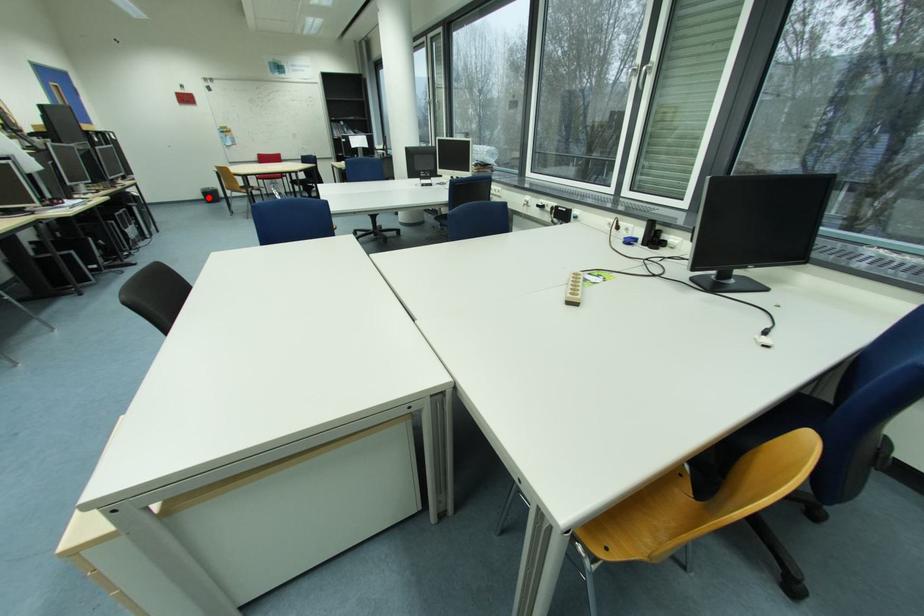
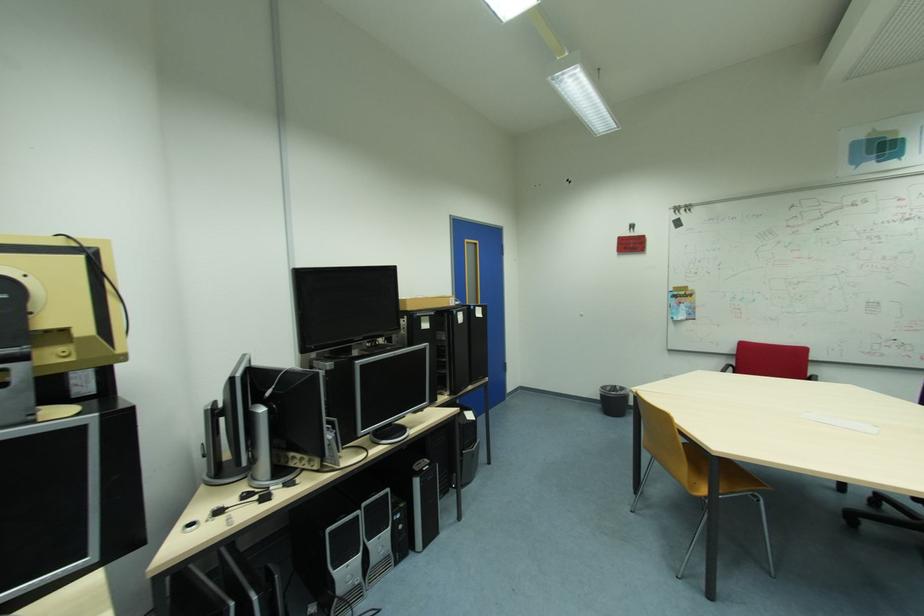
Locate, in the second image, the point that corresponds to the highlighted location in the first image.

(605, 400)